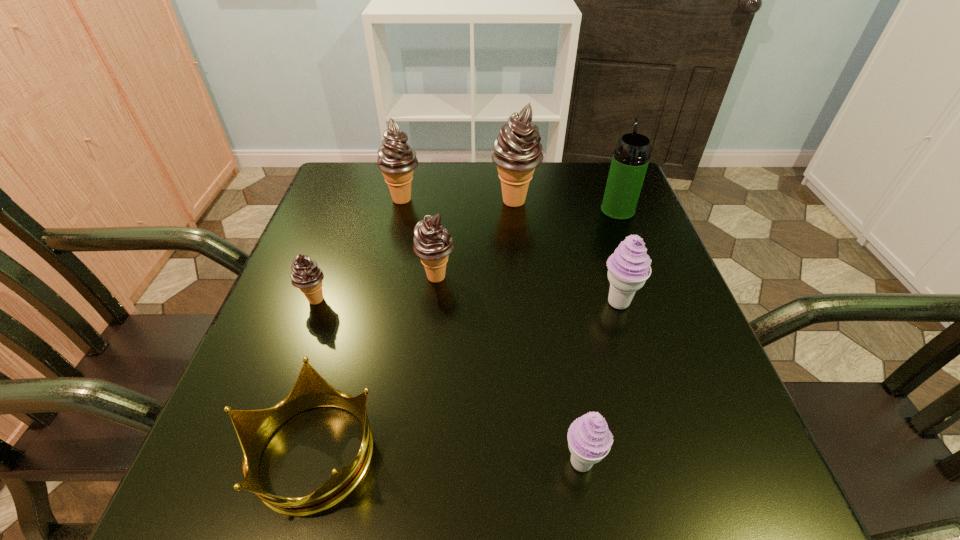
Locate an element on the screen. The width and height of the screenshot is (960, 540). the nearer purple icecream is located at coordinates (589, 439).

You are a GUI agent. You are given a task and a screenshot of the screen. Output one action in this format:
    pyautogui.click(x=<x>, y=<y>)
    Task: Click on the smallest chocolate icecream
    The width and height of the screenshot is (960, 540).
    Given the screenshot: What is the action you would take?
    pyautogui.click(x=305, y=275)

I want to click on the leftmost icecream, so click(x=305, y=275).

Locate an element on the screen. The height and width of the screenshot is (540, 960). the shortest object is located at coordinates (254, 428).

Locate an element on the screen. This screenshot has height=540, width=960. gold crown is located at coordinates (254, 428).

Image resolution: width=960 pixels, height=540 pixels. In order to click on vacant space located 0.250m on the front of the tallest icecream in this screenshot , I will do `click(523, 288)`.

The height and width of the screenshot is (540, 960). What are the coordinates of `free space located 0.140m from the spout of the thermos bottle` in the screenshot? It's located at [603, 172].

What are the coordinates of `free space located from the spout of the thermos bottle` in the screenshot? It's located at (606, 180).

Locate an element on the screen. blank space located from the spout of the thermos bottle is located at coordinates (606, 180).

At what (x,y) coordinates should I click in order to perform the action: click on vacant area situated 0.240m on the front of the second tallest icecream. Please return your answer as a coordinate pair (x, y). Looking at the image, I should click on (385, 278).